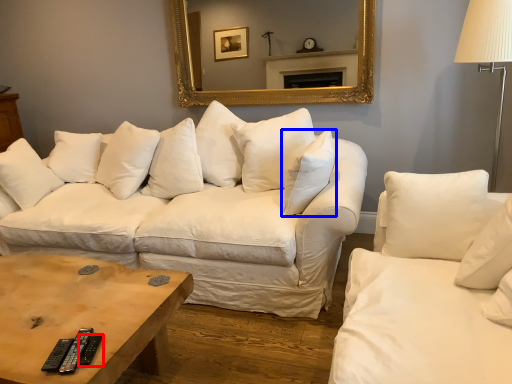
Question: Which object is further to the camera taking this photo, remote (highlighted by a red box) or pillow (highlighted by a blue box)?

Choices:
 (A) remote
 (B) pillow

Answer: (B)